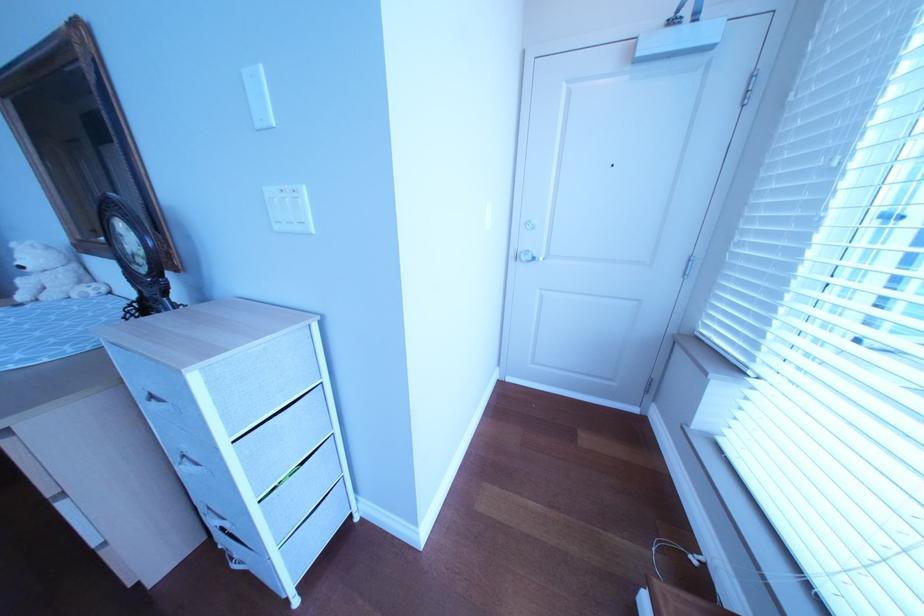
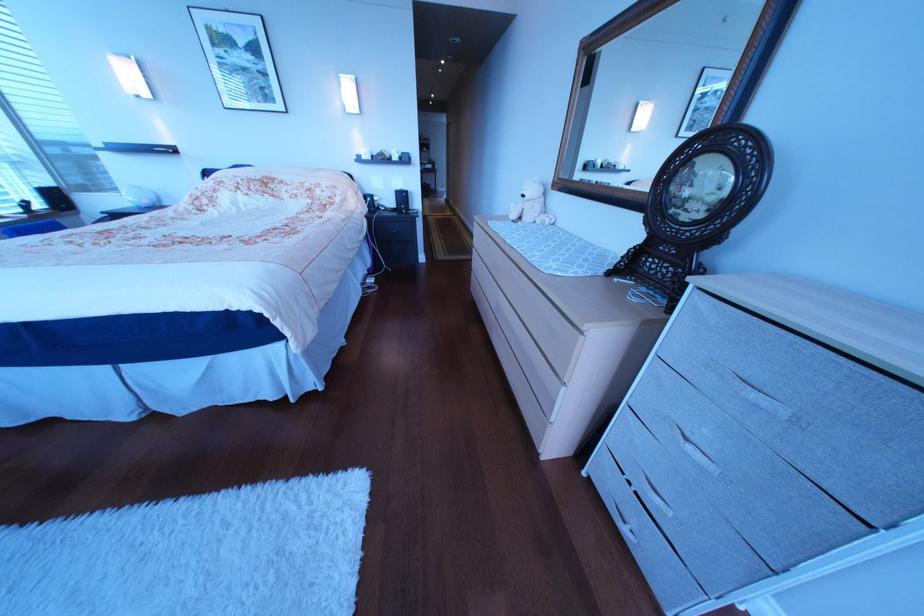
How did the camera likely rotate?

The camera rotated toward left-down.